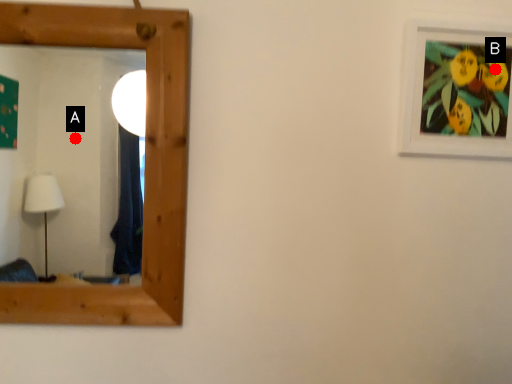
Question: Two points are circled on the image, labeled by A and B beside each circle. Which of the following is the farthest from the observer?

Choices:
 (A) A is further
 (B) B is further

Answer: (A)